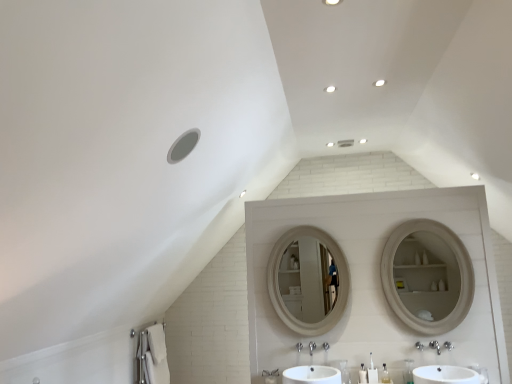
How much space does white glossy sink at center, which ranks as the 1th sink in left-to-right order, occupy horizontally?

The width of white glossy sink at center, which ranks as the 1th sink in left-to-right order, is 17.23 inches.

Find the location of `clear plastic bottle at center, marked as the 3th toiletry in a left-to-right arrangement`. clear plastic bottle at center, marked as the 3th toiletry in a left-to-right arrangement is located at coordinates (385, 375).

Measure the distance between white plastic toothbrush at lower center, which appears as the first toiletry when viewed from the left, and camera.

The depth of white plastic toothbrush at lower center, which appears as the first toiletry when viewed from the left, is 3.16 meters.

Describe the element at coordinates (362, 374) in the screenshot. I see `white plastic pump at center, arranged as the 2th toiletry when viewed from the left` at that location.

How much space does white plastic pump at center, arranged as the 2th toiletry when viewed from the left, occupy horizontally?

3.01 inches.

The width and height of the screenshot is (512, 384). What do you see at coordinates (308, 280) in the screenshot?
I see `white wooden mirror at center` at bounding box center [308, 280].

What do you see at coordinates (408, 371) in the screenshot? I see `clear plastic bottle at center, the fourth toiletry from the left` at bounding box center [408, 371].

Locate an element on the screen. white glossy sink at center, which ranks as the 1th sink in left-to-right order is located at coordinates (311, 375).

Is white wooden mirror at center positioned far away from white cotton bath towel at lower left?

white wooden mirror at center is positioned a significant distance from white cotton bath towel at lower left.

In the scene shown: Can you tell me how much white wooden mirror at center and white cotton bath towel at lower left differ in facing direction?

91.5 degrees separate the facing orientations of white wooden mirror at center and white cotton bath towel at lower left.

Between white wooden mirror at center and white cotton bath towel at lower left, which one has less height?

white cotton bath towel at lower left.

Based on their positions, is white wooden mirror at center located to the left or right of white cotton bath towel at lower left?

In the image, white wooden mirror at center appears on the right side of white cotton bath towel at lower left.

From a real-world perspective, is clear plastic bottle at center, marked as the 3th toiletry in a left-to-right arrangement, positioned above or below brushed metal faucet at center, which appears as the first plumbing fixture when viewed from the left?

clear plastic bottle at center, marked as the 3th toiletry in a left-to-right arrangement, is below brushed metal faucet at center, which appears as the first plumbing fixture when viewed from the left.

Where is `plumbing fixture behind the clear plastic bottle at center, marked as the 3th toiletry in a left-to-right arrangement`? The image size is (512, 384). plumbing fixture behind the clear plastic bottle at center, marked as the 3th toiletry in a left-to-right arrangement is located at coordinates (298, 347).

Is clear plastic bottle at center, which ranks as the second toiletry in right-to-left order, not within brushed metal faucet at center, the 2th plumbing fixture positioned from the right?

Yes, clear plastic bottle at center, which ranks as the second toiletry in right-to-left order, is located beyond the bounds of brushed metal faucet at center, the 2th plumbing fixture positioned from the right.

Is point (382, 374) farther from viewer compared to point (300, 343)?

No, (382, 374) is in front of (300, 343).

Which is less distant, (407, 378) or (298, 351)?

Positioned in front is point (407, 378).

Between clear plastic bottle at center, marked as the 1th toiletry in a right-to-left arrangement, and brushed metal faucet at center, which appears as the first plumbing fixture when viewed from the left, which one appears on the right side from the viewer's perspective?

clear plastic bottle at center, marked as the 1th toiletry in a right-to-left arrangement.

Which object is more forward, clear plastic bottle at center, the fourth toiletry from the left, or brushed metal faucet at center, which appears as the first plumbing fixture when viewed from the left?

clear plastic bottle at center, the fourth toiletry from the left, is in front.

Based on the photo, from the image's perspective, which is below, clear plastic bottle at center, the fourth toiletry from the left, or brushed metal faucet at center, the 2th plumbing fixture positioned from the right?

clear plastic bottle at center, the fourth toiletry from the left.

In the scene shown: Measure the distance between white cotton bath towel at lower left and clear plastic bottle at center, marked as the 1th toiletry in a right-to-left arrangement.

white cotton bath towel at lower left and clear plastic bottle at center, marked as the 1th toiletry in a right-to-left arrangement, are 7.86 feet apart from each other.

Is white cotton bath towel at lower left facing away from clear plastic bottle at center, marked as the 1th toiletry in a right-to-left arrangement?

No, white cotton bath towel at lower left is not facing the opposite direction of clear plastic bottle at center, marked as the 1th toiletry in a right-to-left arrangement.

Is white cotton bath towel at lower left located outside clear plastic bottle at center, the fourth toiletry from the left?

That's correct, white cotton bath towel at lower left is outside of clear plastic bottle at center, the fourth toiletry from the left.

Based on the photo, is white cotton bath towel at lower left not close to clear plastic bottle at center, the fourth toiletry from the left?

Yes.

From the image's perspective, does silver metallic faucet at center, which is the 2th plumbing fixture from left to right, appear higher than white plastic toothbrush at lower center, placed as the fourth toiletry when sorted from right to left?

Yes, from the image's perspective, silver metallic faucet at center, which is the 2th plumbing fixture from left to right, is above white plastic toothbrush at lower center, placed as the fourth toiletry when sorted from right to left.

Is silver metallic faucet at center, which is counted as the first plumbing fixture, starting from the right, far away from white plastic toothbrush at lower center, placed as the fourth toiletry when sorted from right to left?

They are positioned close to each other.

Could you measure the distance between silver metallic faucet at center, which is counted as the first plumbing fixture, starting from the right, and white plastic toothbrush at lower center, placed as the fourth toiletry when sorted from right to left?

silver metallic faucet at center, which is counted as the first plumbing fixture, starting from the right, and white plastic toothbrush at lower center, placed as the fourth toiletry when sorted from right to left, are 10.30 inches apart from each other.

Consider the image. Considering the positions of objects silver metallic faucet at center, which is counted as the first plumbing fixture, starting from the right, and white plastic toothbrush at lower center, which appears as the first toiletry when viewed from the left, in the image provided, who is more to the left, silver metallic faucet at center, which is counted as the first plumbing fixture, starting from the right, or white plastic toothbrush at lower center, which appears as the first toiletry when viewed from the left,?

silver metallic faucet at center, which is counted as the first plumbing fixture, starting from the right.

Looking at this image, how different are the orientations of clear plastic bottle at center, marked as the 1th toiletry in a right-to-left arrangement, and white cotton bath towel at lower left in degrees?

The angular difference between clear plastic bottle at center, marked as the 1th toiletry in a right-to-left arrangement, and white cotton bath towel at lower left is 92.1 degrees.

Who is smaller, clear plastic bottle at center, marked as the 1th toiletry in a right-to-left arrangement, or white cotton bath towel at lower left?

Smaller between the two is clear plastic bottle at center, marked as the 1th toiletry in a right-to-left arrangement.

From a real-world perspective, who is located higher, clear plastic bottle at center, the fourth toiletry from the left, or white cotton bath towel at lower left?

clear plastic bottle at center, the fourth toiletry from the left, from a real-world perspective.

Identify the location of the 4th toiletry in front of the white cotton bath towel at lower left, counting from the anchor's position. (408, 371).

Image resolution: width=512 pixels, height=384 pixels. In order to click on toiletry that is the 3rd one below the white wooden mirror at center (from a real-world perspective) in this screenshot , I will do `click(362, 374)`.

Is white wooden mirror at center taller than white plastic pump at center, arranged as the 2th toiletry when viewed from the left?

Indeed, white wooden mirror at center has a greater height compared to white plastic pump at center, arranged as the 2th toiletry when viewed from the left.

Is white wooden mirror at center positioned beyond the bounds of white plastic pump at center, arranged as the 2th toiletry when viewed from the left?

Yes, white wooden mirror at center is outside of white plastic pump at center, arranged as the 2th toiletry when viewed from the left.

How different are the orientations of white wooden mirror at center and white plastic pump at center, the third toiletry when ordered from right to left, in degrees?

0.0238 degrees.

Where is `mirror lying on the right of white cotton bath towel at lower left`? This screenshot has height=384, width=512. mirror lying on the right of white cotton bath towel at lower left is located at coordinates (308, 280).

Starting from the brushed metal faucet at center, which appears as the first plumbing fixture when viewed from the left, which toiletry is the 2nd one in front? Please provide its 2D coordinates.

[(385, 375)]

Estimate the real-world distances between objects in this image. Which object is closer to white cotton bath towel at lower left, brushed metal faucet at center, which appears as the first plumbing fixture when viewed from the left, or white glossy sink at center, which ranks as the 1th sink in left-to-right order?

white glossy sink at center, which ranks as the 1th sink in left-to-right order, lies closer to white cotton bath towel at lower left than the other object.

Considering their positions, is white plastic toothbrush at lower center, placed as the fourth toiletry when sorted from right to left, positioned closer to white glossy sink at center, which ranks as the 1th sink in left-to-right order, than clear plastic bottle at center, which ranks as the second toiletry in right-to-left order?

white plastic toothbrush at lower center, placed as the fourth toiletry when sorted from right to left.

From the image, which object appears to be farther from brushed metal faucet at center, the 2th plumbing fixture positioned from the right, silver metallic faucet at center, which is counted as the first plumbing fixture, starting from the right, or clear plastic bottle at center, the fourth toiletry from the left?

The object further to brushed metal faucet at center, the 2th plumbing fixture positioned from the right, is clear plastic bottle at center, the fourth toiletry from the left.

Which object lies nearer to the anchor point white cotton bath towel at lower left, white glossy sink at center, which ranks as the 1th sink in left-to-right order, or clear plastic bottle at center, which ranks as the second toiletry in right-to-left order?

Based on the image, white glossy sink at center, which ranks as the 1th sink in left-to-right order, appears to be nearer to white cotton bath towel at lower left.

Based on their spatial positions, is brushed metal faucet at center, the 2th plumbing fixture positioned from the right, or white glossy sink at center, which ranks as the 1th sink in left-to-right order, closer to clear plastic bottle at center, marked as the 3th toiletry in a left-to-right arrangement?

white glossy sink at center, which ranks as the 1th sink in left-to-right order.

Based on their spatial positions, is clear plastic bottle at center, which ranks as the second toiletry in right-to-left order, or brushed metal faucet at center, the 2th plumbing fixture positioned from the right, further from silver metallic faucet at center, which is the 2th plumbing fixture from left to right?

The object further to silver metallic faucet at center, which is the 2th plumbing fixture from left to right, is clear plastic bottle at center, which ranks as the second toiletry in right-to-left order.

Which object lies nearer to the anchor point white cotton bath towel at lower left, clear plastic bottle at center, marked as the 3th toiletry in a left-to-right arrangement, or clear plastic bottle at center, marked as the 1th toiletry in a right-to-left arrangement?

clear plastic bottle at center, marked as the 3th toiletry in a left-to-right arrangement, is positioned closer to the anchor white cotton bath towel at lower left.

When comparing their distances from brushed metal faucet at center, which appears as the first plumbing fixture when viewed from the left, does white glossy sink at center, which ranks as the 1th sink in left-to-right order, or clear plastic bottle at center, which ranks as the second toiletry in right-to-left order, seem further?

clear plastic bottle at center, which ranks as the second toiletry in right-to-left order.

Where is `toiletry between brushed metal faucet at center, which appears as the first plumbing fixture when viewed from the left, and white plastic pump at center, arranged as the 2th toiletry when viewed from the left, in the horizontal direction`? The image size is (512, 384). toiletry between brushed metal faucet at center, which appears as the first plumbing fixture when viewed from the left, and white plastic pump at center, arranged as the 2th toiletry when viewed from the left, in the horizontal direction is located at coordinates (344, 371).

Where is `toiletry between white glossy sink at lower center, which is the first sink from right to left, and white plastic pump at center, arranged as the 2th toiletry when viewed from the left, from front to back`? toiletry between white glossy sink at lower center, which is the first sink from right to left, and white plastic pump at center, arranged as the 2th toiletry when viewed from the left, from front to back is located at coordinates (408, 371).

Locate an element on the screen. The width and height of the screenshot is (512, 384). sink between white cotton bath towel at lower left and white wooden mirror at center in the horizontal direction is located at coordinates (311, 375).

Where is `sink between white cotton bath towel at lower left and clear plastic bottle at center, the fourth toiletry from the left, from left to right`? sink between white cotton bath towel at lower left and clear plastic bottle at center, the fourth toiletry from the left, from left to right is located at coordinates (311, 375).